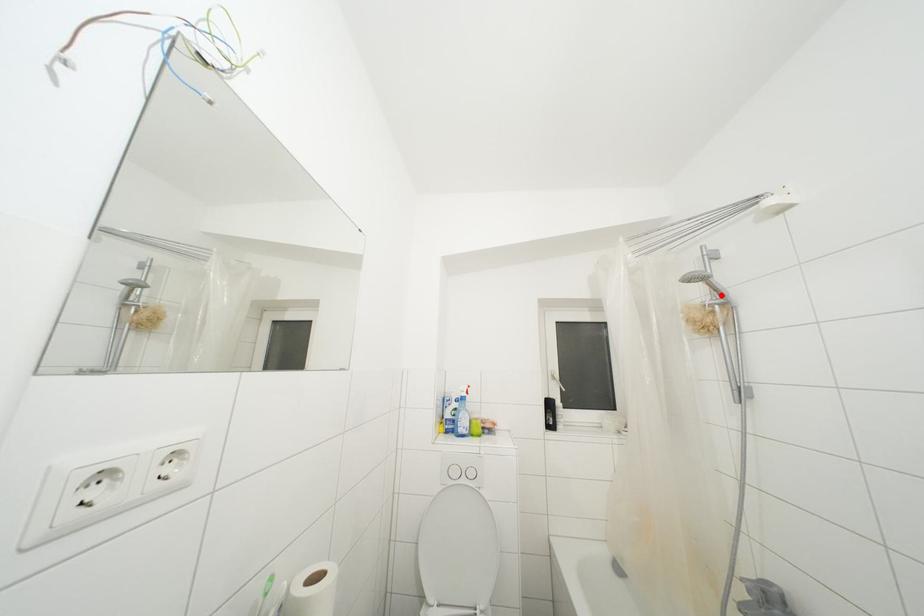
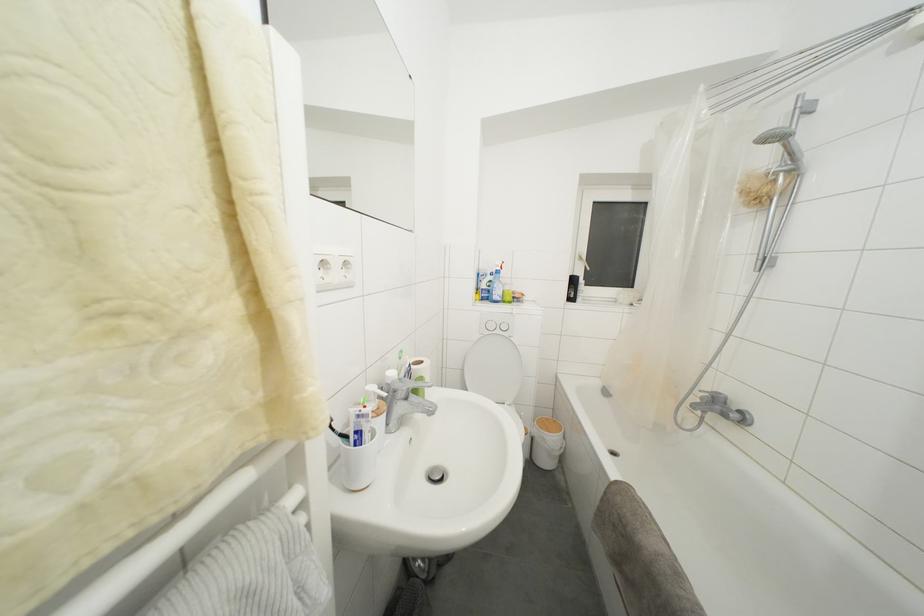
Locate, in the second image, the point that corresponds to the highlighted location in the first image.

(796, 159)